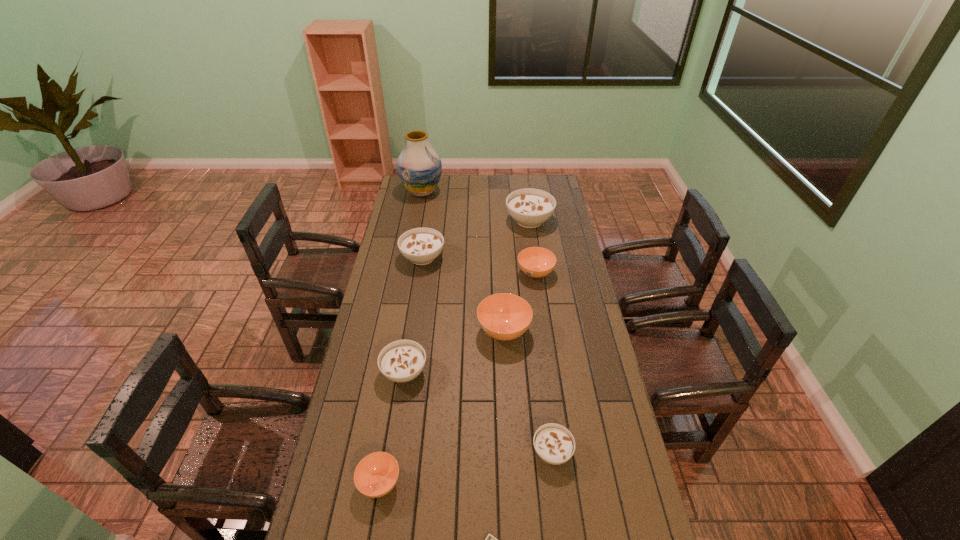
Identify the location of the farthest object. (419, 167).

The image size is (960, 540). In order to click on vase in this screenshot , I will do `click(419, 167)`.

The width and height of the screenshot is (960, 540). I want to click on the biggest white soup bowl, so click(529, 207).

Identify the location of the farthest soup bowl. Image resolution: width=960 pixels, height=540 pixels. (529, 207).

You are a GUI agent. You are given a task and a screenshot of the screen. Output one action in this format:
    pyautogui.click(x=<x>, y=<y>)
    Task: Click on the fifth nearest object
    This screenshot has width=960, height=540.
    Given the screenshot: What is the action you would take?
    pyautogui.click(x=503, y=316)

I want to click on the biggest peach soup bowl, so click(503, 316).

Identify the location of the third smallest white soup bowl. (421, 246).

What are the coordinates of `the second biggest peach soup bowl` in the screenshot? It's located at (536, 262).

Image resolution: width=960 pixels, height=540 pixels. Identify the location of the fifth farthest soup bowl. (400, 361).

Locate an element on the screen. the second smallest white soup bowl is located at coordinates (400, 361).